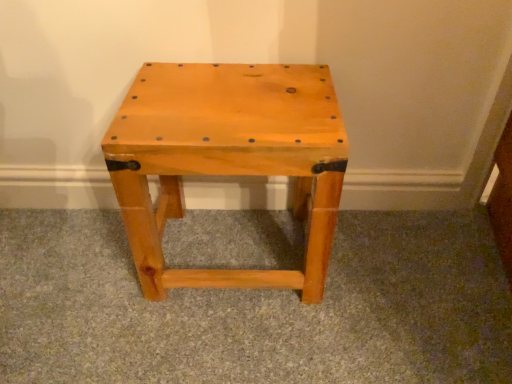
In order to face natural wood stool at center, should I rotate leftwards or rightwards?

To align with it, rotate left about 3.392°.

I want to click on natural wood stool at center, so click(227, 159).

What do you see at coordinates (227, 159) in the screenshot? I see `natural wood stool at center` at bounding box center [227, 159].

Locate an element on the screen. natural wood stool at center is located at coordinates point(227,159).